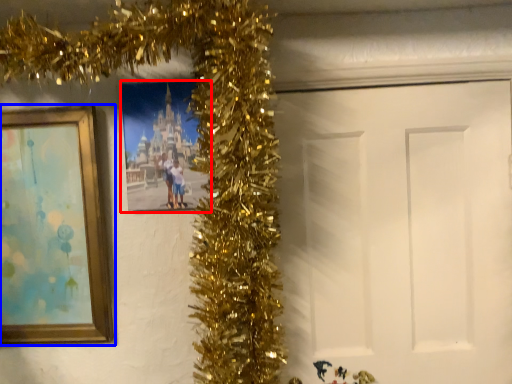
Question: Which of the following is the closest to the observer, picture frame (highlighted by a red box) or picture frame (highlighted by a blue box)?

Choices:
 (A) picture frame
 (B) picture frame

Answer: (B)